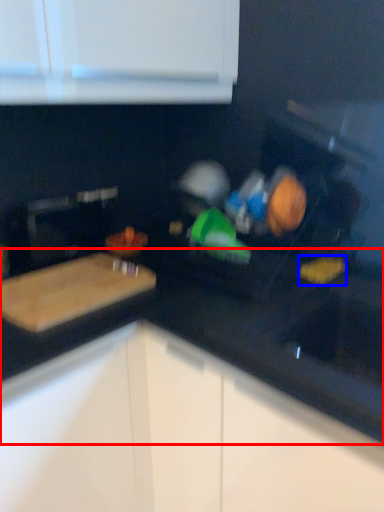
Question: Which of the following is the farthest to the observer, countertop (highlighted by a red box) or food (highlighted by a blue box)?

Choices:
 (A) countertop
 (B) food

Answer: (B)